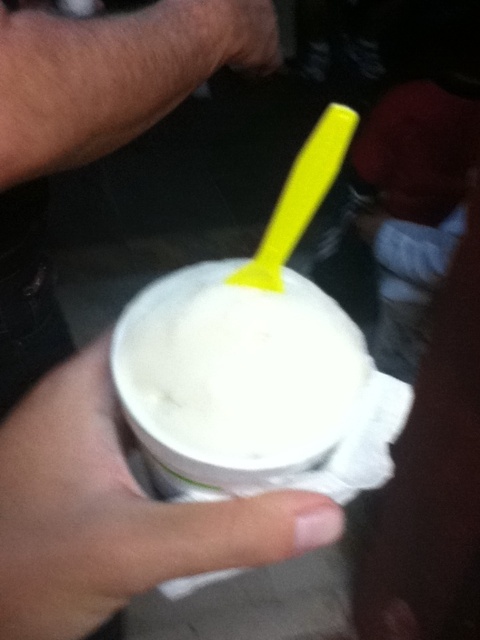
Question: Which object appears farthest from the camera in this image?

Choices:
 (A) white matte ice cream at center
 (B) white matte cup at center

Answer: (A)

Question: Can you confirm if white matte cup at center is positioned above white matte ice cream at center?

Choices:
 (A) yes
 (B) no

Answer: (B)

Question: Is white matte cup at center to the right of white matte ice cream at center from the viewer's perspective?

Choices:
 (A) yes
 (B) no

Answer: (B)

Question: Does white matte cup at center have a smaller size compared to white matte ice cream at center?

Choices:
 (A) no
 (B) yes

Answer: (A)